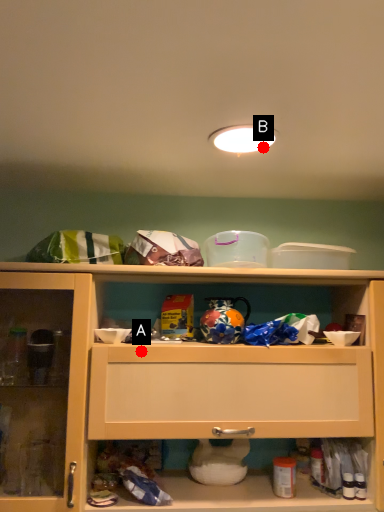
Question: Two points are circled on the image, labeled by A and B beside each circle. Which point appears closest to the camera in this image?

Choices:
 (A) A is closer
 (B) B is closer

Answer: (B)